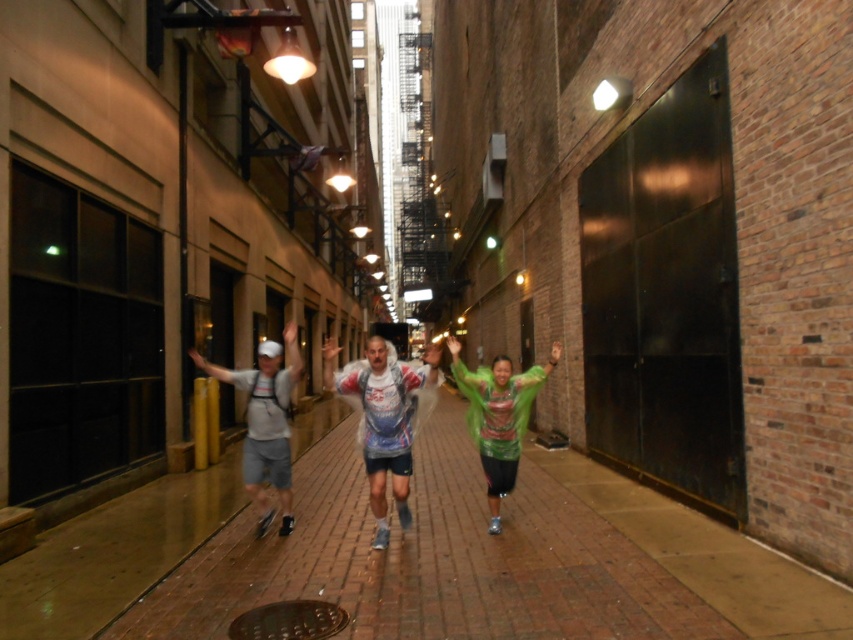
You are a photographer standing in the alleyway and want to capture both the white matte running suit at center and the white matte shorts at left in a single frame. Based on their heights, which object should you focus on first to ensure both are in the shot?

The white matte running suit at center has a lesser height compared to the white matte shorts at left. To ensure both are in the shot, focus on the white matte shorts at left first as it is taller and will require more framing space.

You are a delivery person carrying a large box that is 10 feet long. You need to navigate through the narrow alleyway shown in the image. There is a white matte shorts at left and a green matte jacket at center in your path. Can you fit the box between these two objects without bending it?

The distance between the white matte shorts at left and the green matte jacket at center is 11.28 feet, which is slightly longer than the 10 feet length of the box. Therefore, the box can fit between them without bending.

You are a pedestrian walking through the alley and notice two items on the ground. You see the white matte running suit at center and the white matte shorts at left. Which item is closer to your feet as you walk past them?

The white matte running suit at center is closer to your feet because it is positioned below the white matte shorts at left, meaning it is lower and nearer to the ground level where you are walking.